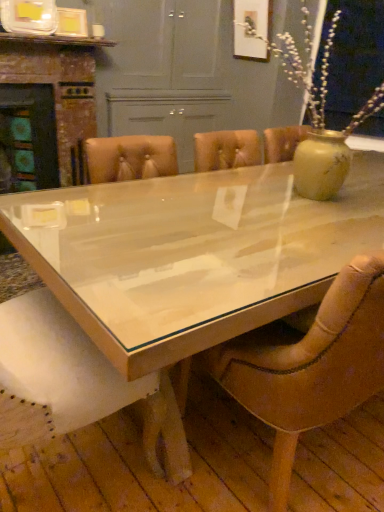
Question: Can you confirm if wooden fireplace at left is shorter than leather at center?

Choices:
 (A) no
 (B) yes

Answer: (A)

Question: Can leather at center be found inside wooden fireplace at left?

Choices:
 (A) no
 (B) yes

Answer: (A)

Question: From the image's perspective, does wooden fireplace at left appear higher than leather at center?

Choices:
 (A) no
 (B) yes

Answer: (B)

Question: Does wooden fireplace at left have a smaller size compared to leather at center?

Choices:
 (A) no
 (B) yes

Answer: (A)

Question: Is wooden fireplace at left outside leather at center?

Choices:
 (A) yes
 (B) no

Answer: (A)

Question: Considering the positions of clear glass table at center and leather at center in the image, is clear glass table at center taller or shorter than leather at center?

Choices:
 (A) short
 (B) tall

Answer: (A)

Question: From the image's perspective, relative to leather at center, is clear glass table at center above or below?

Choices:
 (A) above
 (B) below

Answer: (A)

Question: Do you think clear glass table at center is within leather at center, or outside of it?

Choices:
 (A) outside
 (B) inside

Answer: (A)

Question: Is point (135, 203) positioned closer to the camera than point (357, 327)?

Choices:
 (A) farther
 (B) closer

Answer: (A)

Question: Looking at their shapes, would you say leather at center is wider or thinner than wooden fireplace at left?

Choices:
 (A) wide
 (B) thin

Answer: (A)

Question: From their relative heights in the image, would you say leather at center is taller or shorter than wooden fireplace at left?

Choices:
 (A) short
 (B) tall

Answer: (A)

Question: Considering the positions of point (296, 366) and point (69, 87), is point (296, 366) closer or farther from the camera than point (69, 87)?

Choices:
 (A) farther
 (B) closer

Answer: (B)

Question: From the image's perspective, is leather at center above or below wooden fireplace at left?

Choices:
 (A) above
 (B) below

Answer: (B)

Question: Is point (61, 153) positioned closer to the camera than point (283, 361)?

Choices:
 (A) farther
 (B) closer

Answer: (A)

Question: Is wooden fireplace at left inside the boundaries of leather at center, or outside?

Choices:
 (A) outside
 (B) inside

Answer: (A)